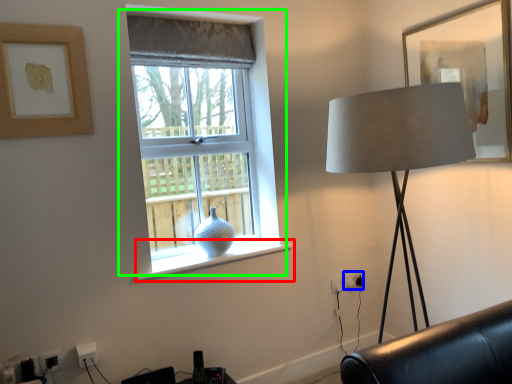
Question: Considering the real-world distances, which object is closest to window sill (highlighted by a red box)? electric outlet (highlighted by a blue box) or window (highlighted by a green box).

Choices:
 (A) electric outlet
 (B) window

Answer: (B)